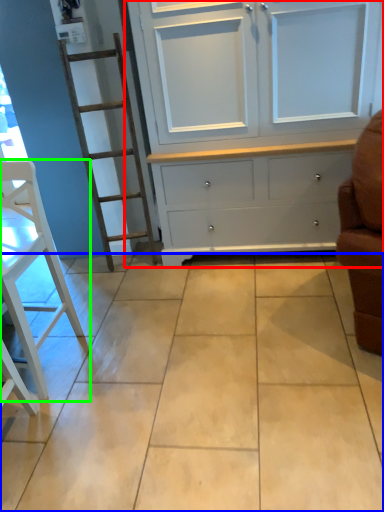
Question: Estimate the real-world distances between objects in this image. Which object is closer to cupboard (highlighted by a red box), ceramic tile (highlighted by a blue box) or furniture (highlighted by a green box)?

Choices:
 (A) ceramic tile
 (B) furniture

Answer: (A)